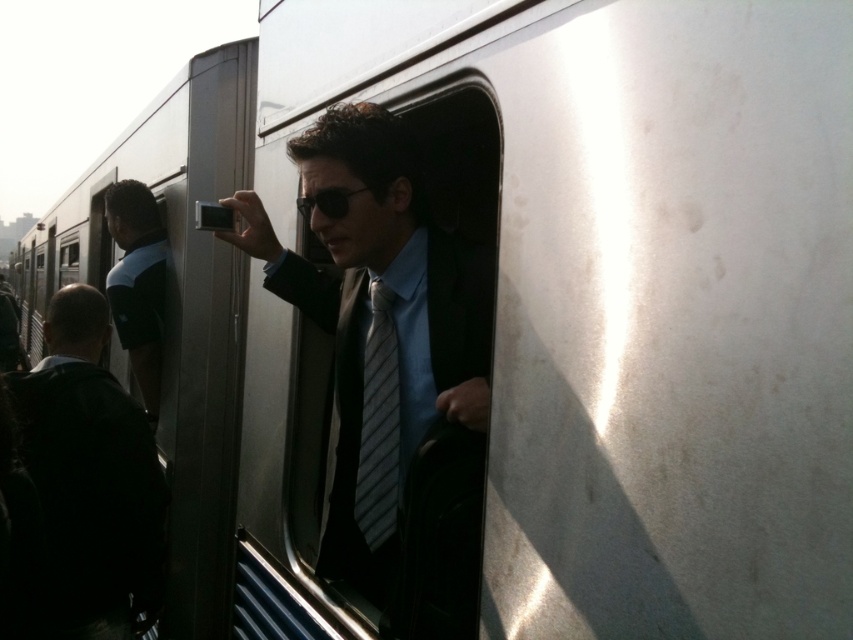
Can you confirm if dark blue shirt at left is positioned below striped fabric tie at center?

Actually, dark blue shirt at left is above striped fabric tie at center.

Is dark blue shirt at left smaller than striped fabric tie at center?

Incorrect, dark blue shirt at left is not smaller in size than striped fabric tie at center.

In order to click on dark blue shirt at left in this screenshot , I will do [138, 284].

Between matte black suit at center and striped fabric tie at center, which one is positioned lower?

matte black suit at center is lower down.

Can you confirm if matte black suit at center is thinner than striped fabric tie at center?

No.

What are the coordinates of `matte black suit at center` in the screenshot? It's located at (91, 477).

Who is positioned more to the right, shiny black suit at center or striped fabric tie at center?

striped fabric tie at center is more to the right.

The width and height of the screenshot is (853, 640). What are the coordinates of `shiny black suit at center` in the screenshot? It's located at [x=389, y=369].